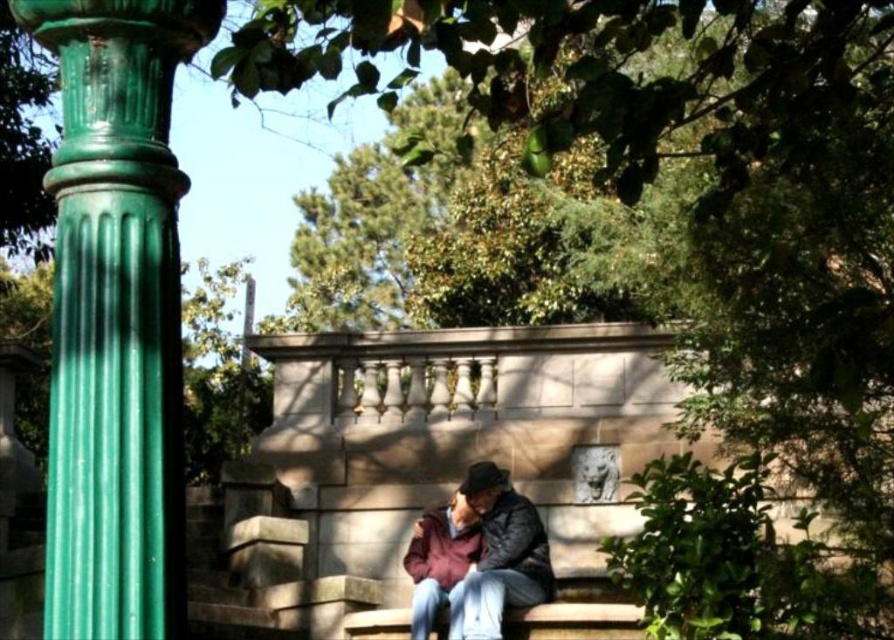
Does green polished stone column at left appear on the left side of maroon fabric jacket at center?

Correct, you'll find green polished stone column at left to the left of maroon fabric jacket at center.

Between green polished stone column at left and maroon fabric jacket at center, which one is positioned higher?

Positioned higher is green polished stone column at left.

The height and width of the screenshot is (640, 894). What do you see at coordinates (116, 316) in the screenshot? I see `green polished stone column at left` at bounding box center [116, 316].

I want to click on green polished stone column at left, so click(116, 316).